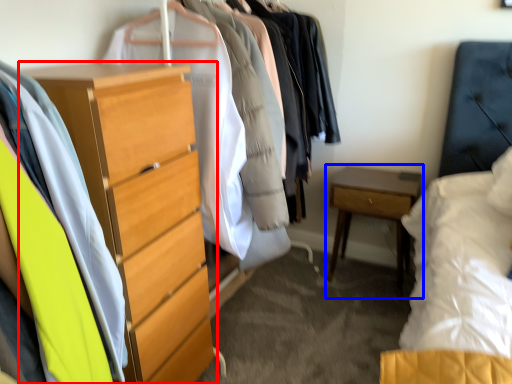
Question: Which point is further to the camera, chest of drawers (highlighted by a red box) or nightstand (highlighted by a blue box)?

Choices:
 (A) chest of drawers
 (B) nightstand

Answer: (B)